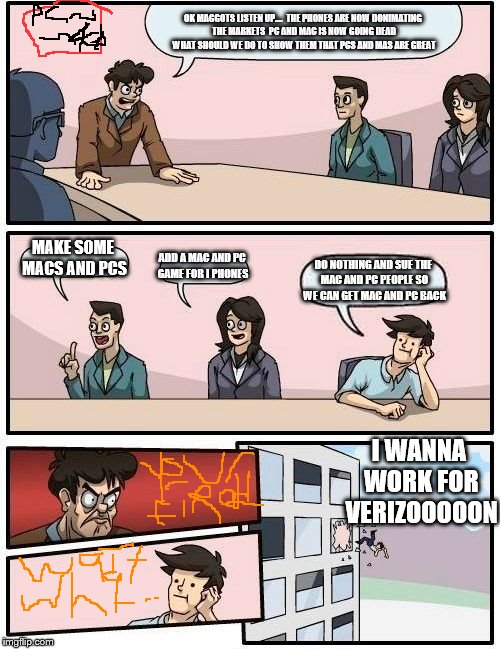
In order to click on cartoon meeting table in this screenshot , I will do `click(215, 200)`, `click(258, 195)`, `click(179, 413)`, `click(81, 407)`, `click(287, 405)`.